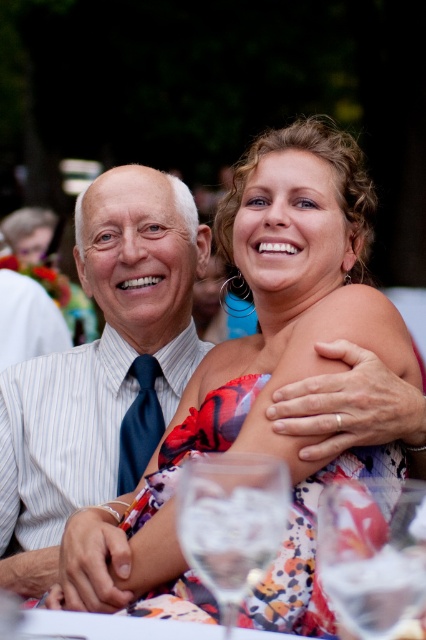
Who is lower down, floral dress at center or clear glass wine glass at lower center?

clear glass wine glass at lower center is lower down.

Does floral dress at center have a lesser width compared to clear glass wine glass at lower center?

No.

Find the location of `floral dress at center`. floral dress at center is located at coordinates (253, 381).

Which of these two, floral dress at center or white striped shirt at left, stands taller?

white striped shirt at left

Locate an element on the screen. The width and height of the screenshot is (426, 640). floral dress at center is located at coordinates coord(253,381).

Who is positioned more to the left, white striped shirt at left or clear glass wine glass at lower center?

Positioned to the left is white striped shirt at left.

Is point (173, 204) positioned behind point (198, 516)?

That is True.

Find the location of a particular element. white striped shirt at left is located at coordinates (103, 368).